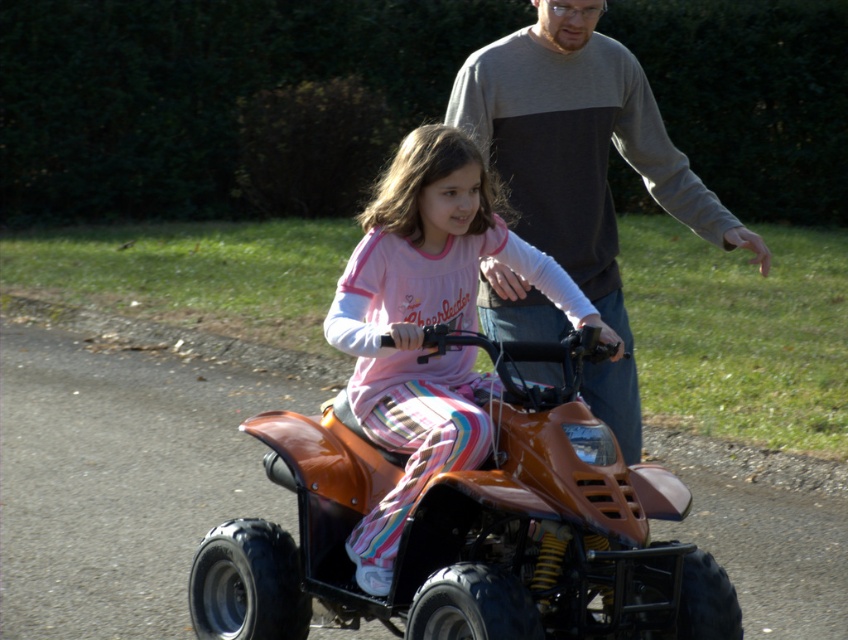
Question: Among these objects, which one is nearest to the camera?

Choices:
 (A) orange matte quad bike at center
 (B) matte orange quad bike at center

Answer: (A)

Question: Based on their relative distances, which object is nearer to the orange matte quad bike at center?

Choices:
 (A) gray/black sweater at upper center
 (B) matte orange quad bike at center

Answer: (B)

Question: Is the position of orange matte quad bike at center more distant than that of gray/black sweater at upper center?

Choices:
 (A) yes
 (B) no

Answer: (B)

Question: Which point is farther to the camera?

Choices:
 (A) (528, 68)
 (B) (448, 273)

Answer: (A)

Question: Is orange matte quad bike at center below matte orange quad bike at center?

Choices:
 (A) no
 (B) yes

Answer: (B)

Question: Can you confirm if orange matte quad bike at center is positioned above gray/black sweater at upper center?

Choices:
 (A) yes
 (B) no

Answer: (B)